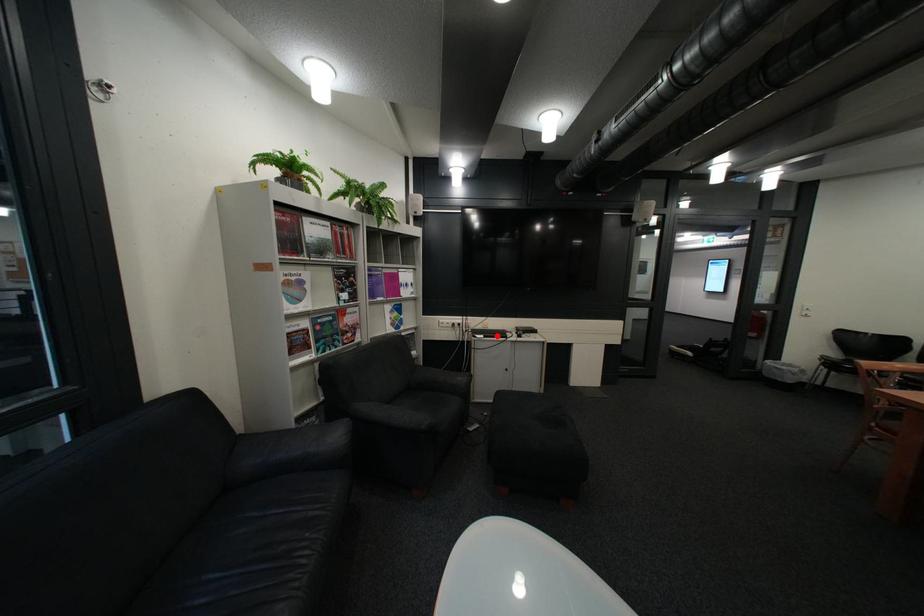
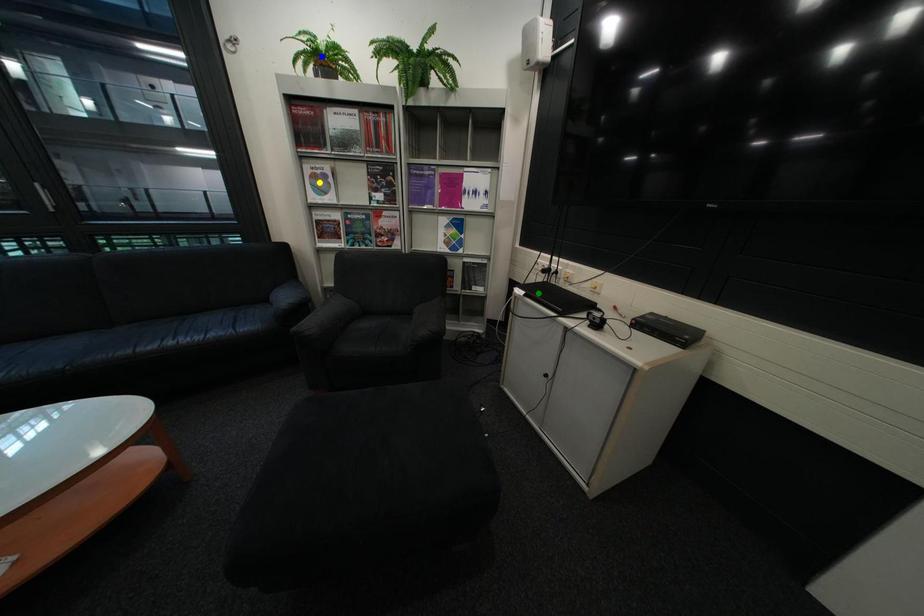
Question: I am providing you with two images of the same scene from different viewpoints. A red point is marked on the first image. You are given multiple points on the second image. Which mark in image 2 goes with the point in image 1?

Choices:
 (A) yellow point
 (B) green point
 (C) blue point

Answer: (B)